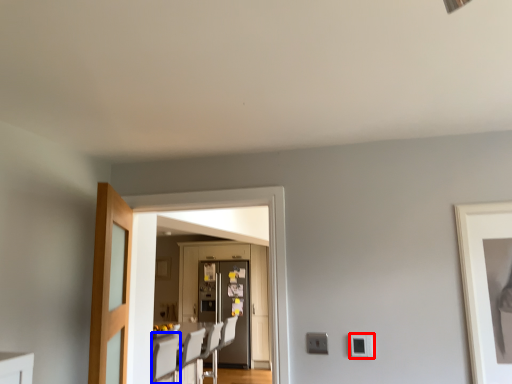
Question: Among these objects, which one is nearest to the camera, light switch (highlighted by a red box) or chair (highlighted by a blue box)?

Choices:
 (A) light switch
 (B) chair

Answer: (A)